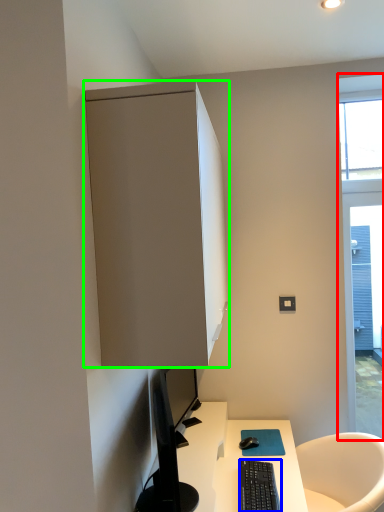
Question: Which object is the farthest from window (highlighted by a red box)? Choose among these: computer keyboard (highlighted by a blue box) or cabinetry (highlighted by a green box).

Choices:
 (A) computer keyboard
 (B) cabinetry

Answer: (B)